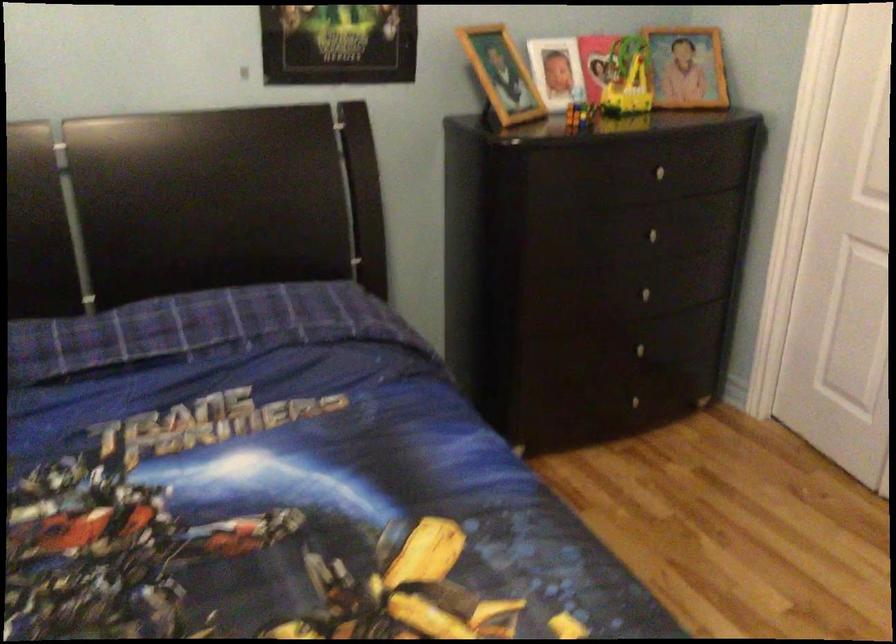
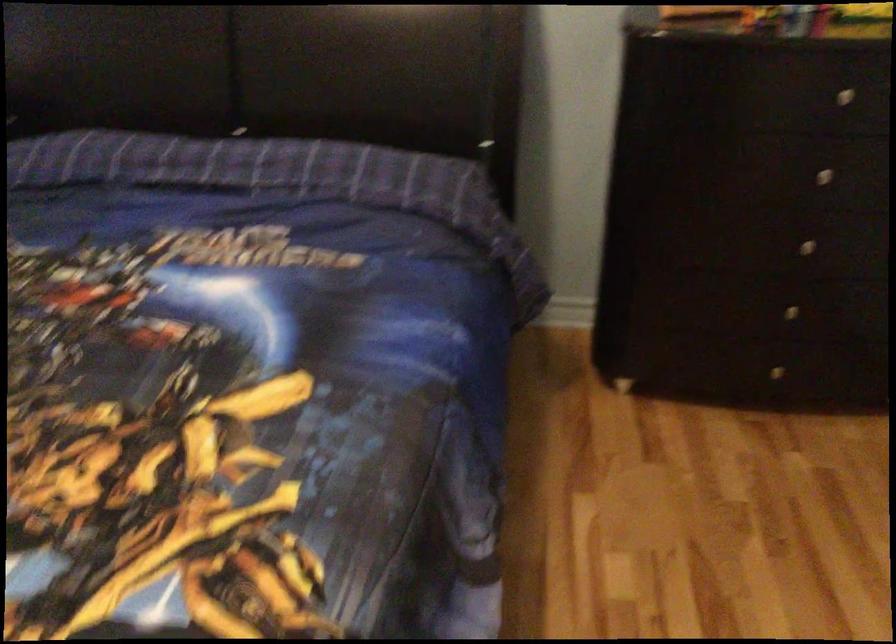
Question: The camera is either moving clockwise (left) or counter-clockwise (right) around the object. The first image is from the beginning of the video and the second image is from the end. Is the camera moving left or right when shooting the video?

Choices:
 (A) Left
 (B) Right

Answer: (B)